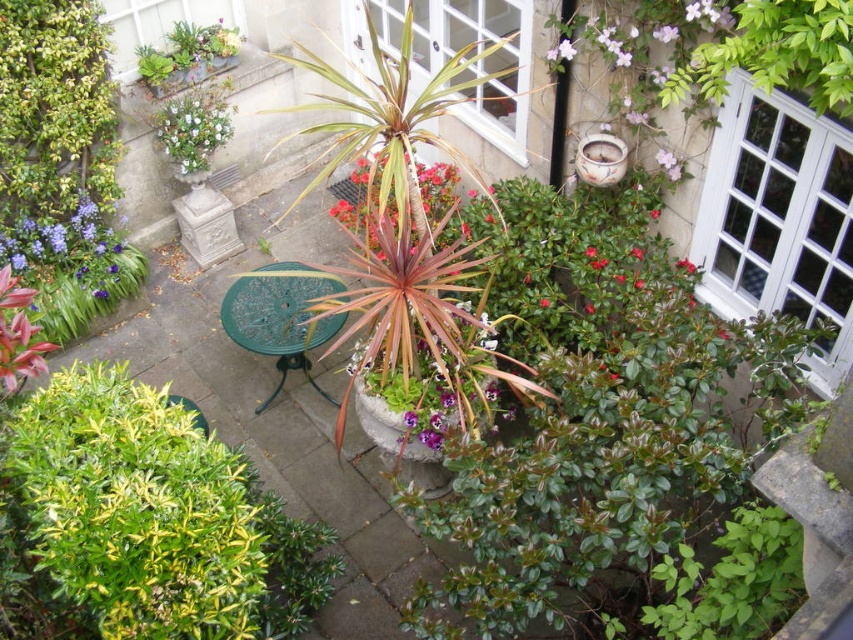
You are standing on the patio and want to place a new potted fern between the green leafy bush at lower left and the brown textured plant at center. Based on their positions, which direction should you move the fern to ensure it is positioned between them?

The green leafy bush at lower left is in front of the brown textured plant at center, so to place the fern between them, you should move it forward towards the green leafy bush at lower left and backward towards the brown textured plant at center.

You are standing at the edge of the patio and want to place a 1.5 meter long bench between the green leafy bush at lower left and the brown textured plant at center. Will there be enough space to fit the bench between them?

The green leafy bush at lower left is 2.06 meters from the brown textured plant at center. Since the bench is 1.5 meters long, there is sufficient space to place it between them as the distance between the two objects is greater than the bench length.

You are standing at the edge of the patio and want to walk to the point that is closer to you. Which point should you head towards, point (3, 161) or point (340, 212)?

Point (3, 161) is closer to the viewer than point (340, 212), so you should head towards point (3, 161).